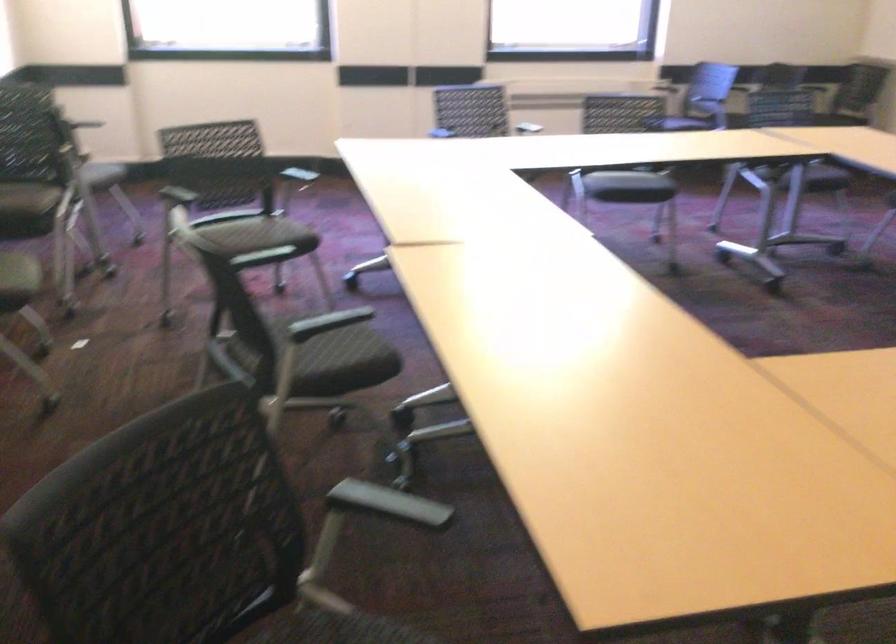
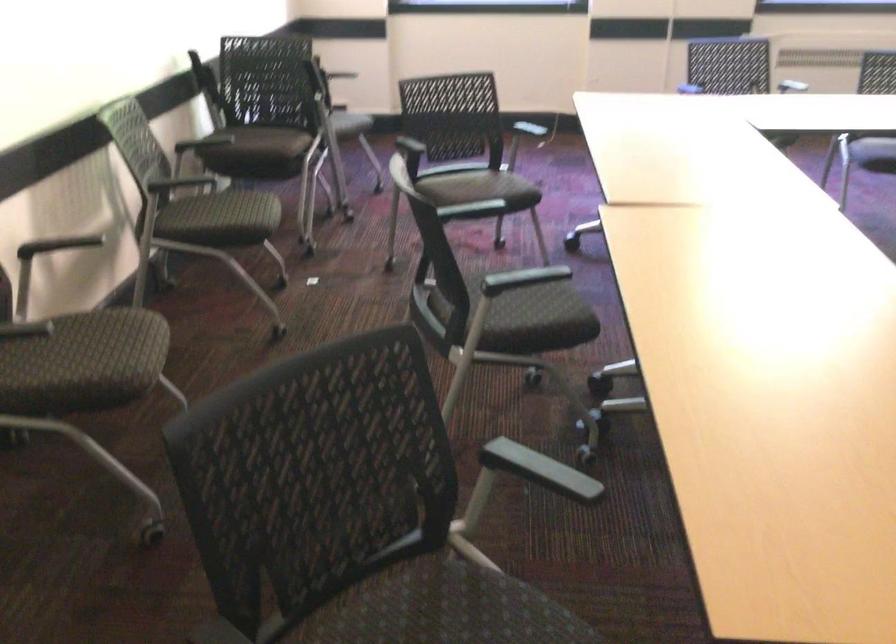
Which direction would the cameraman need to move to produce the second image?

The cameraman walked toward right, forward.